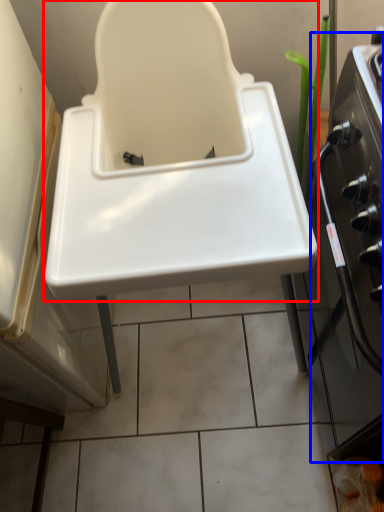
Question: Among these objects, which one is nearest to the camera, sink (highlighted by a red box) or oven (highlighted by a blue box)?

Choices:
 (A) sink
 (B) oven

Answer: (A)